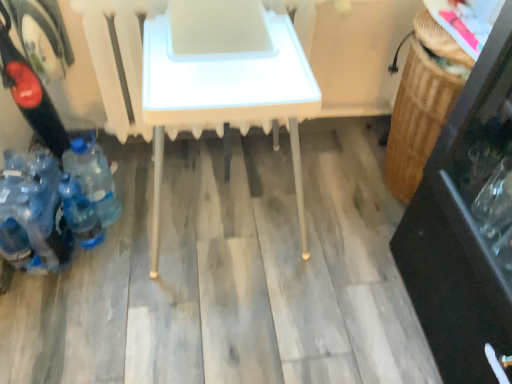
Where is `free spot below white plastic table at center (from a real-world perspective)`? The image size is (512, 384). free spot below white plastic table at center (from a real-world perspective) is located at coordinates (219, 222).